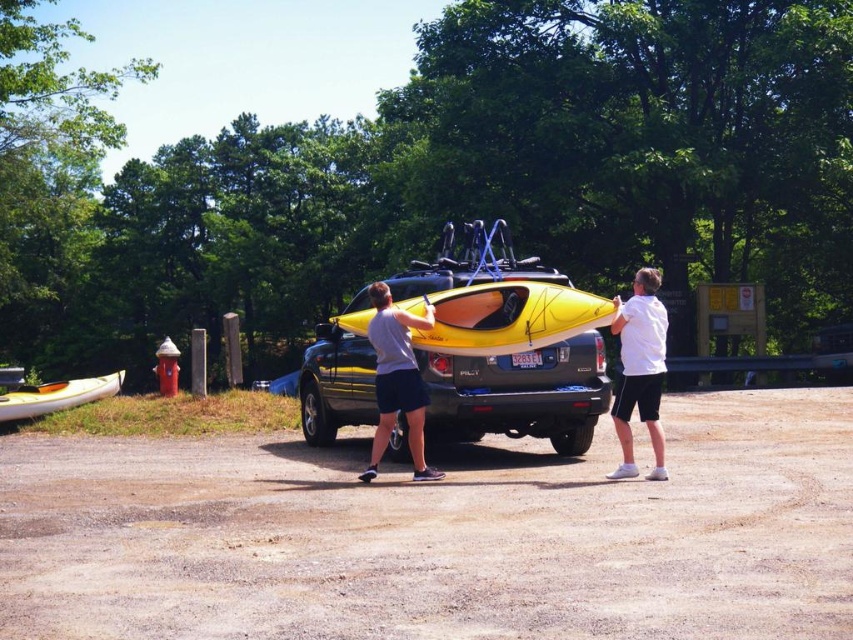
You are a visitor at the park and want to know which object is taller between the white matte shirt at right and the white glossy canoe at lower left. Can you tell me?

The white matte shirt at right is taller than the white glossy canoe at lower left.

You are trying to figure out the spatial relationship between the two people in the parking lot. According to the image, is the person wearing the white matte shirt at right standing below or above the person in matte gray shorts at center?

The white matte shirt at right is positioned under the matte gray shorts at center, so the person in the white matte shirt at right is standing below the person in matte gray shorts at center.

You are standing at the point labeled point (422, 467) and want to walk to the point labeled point (485, 349). Which direction should you face to move towards your destination?

You should face north because point (485, 349) is behind point (422, 467), meaning it is in the northern direction relative to your current position.